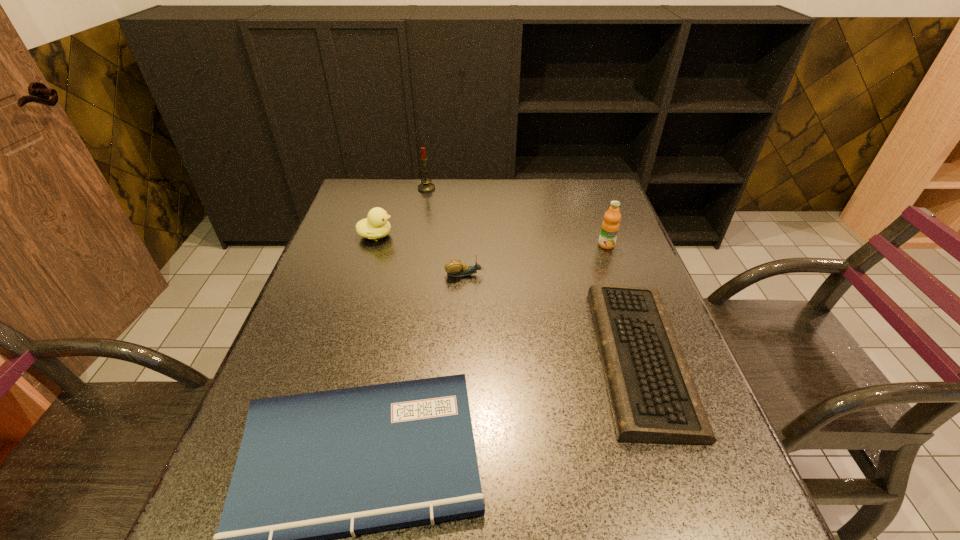
Identify the location of free spot located 0.080m on the left of the computer keyboard. The width and height of the screenshot is (960, 540). (560, 358).

Locate an element on the screen. object that is at the far edge is located at coordinates (426, 186).

I want to click on object present at the left edge, so click(376, 226).

Where is `orange juice at the right edge`? This screenshot has height=540, width=960. orange juice at the right edge is located at coordinates (610, 225).

Where is `computer keyboard that is positioned at the right edge`? computer keyboard that is positioned at the right edge is located at coordinates (653, 397).

In the image, there is a desktop. What are the coordinates of `free space at the far edge` in the screenshot? It's located at (501, 212).

I want to click on free space at the near edge of the desktop, so click(x=587, y=515).

I want to click on free region at the left edge of the desktop, so click(x=328, y=249).

Where is `free space at the right edge of the desktop`? Image resolution: width=960 pixels, height=540 pixels. free space at the right edge of the desktop is located at coordinates (626, 275).

Locate an element on the screen. The image size is (960, 540). vacant space that's between the escargot and the candle is located at coordinates (445, 232).